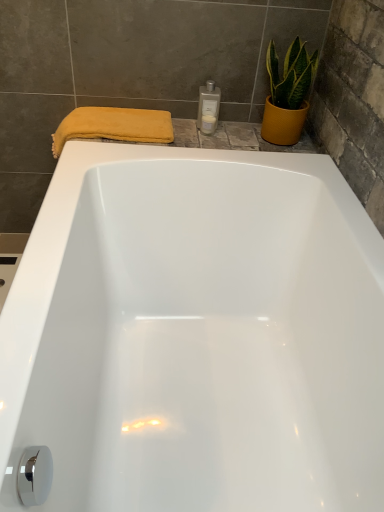
I want to click on yellow soft towel at upper left, so click(114, 126).

Does white glossy bottle at upper center, which is the first toiletry from bottom to top, have a smaller size compared to yellow textured pot at upper right?

Yes.

Is white glossy bottle at upper center, which is the first toiletry from bottom to top, shorter than yellow textured pot at upper right?

Correct, white glossy bottle at upper center, which is the first toiletry from bottom to top, is not as tall as yellow textured pot at upper right.

Do you think white glossy bottle at upper center, which is the first toiletry from bottom to top, is within yellow textured pot at upper right, or outside of it?

white glossy bottle at upper center, which is the first toiletry from bottom to top, is not inside yellow textured pot at upper right, it's outside.

Which point is more distant from viewer, (202, 126) or (281, 116)?

The point (202, 126) is more distant.

In order to click on houseplant above the white glossy bottle at upper center, the second toiletry positioned from the top (from the image's perspective) in this screenshot , I will do `click(288, 93)`.

Does yellow textured pot at upper right have a greater width compared to white glossy bottle at upper center, the second toiletry positioned from the top?

Yes.

How much distance is there between yellow textured pot at upper right and white glossy bottle at upper center, the second toiletry positioned from the top?

yellow textured pot at upper right is 9.64 inches away from white glossy bottle at upper center, the second toiletry positioned from the top.

Can you confirm if yellow textured pot at upper right is bigger than white glossy bottle at upper center, the second toiletry positioned from the top?

Yes.

Can you confirm if yellow soft towel at upper left is positioned to the right of white glossy bottle at upper right, which appears as the second toiletry when ordered from the bottom?

In fact, yellow soft towel at upper left is to the left of white glossy bottle at upper right, which appears as the second toiletry when ordered from the bottom.

From a real-world perspective, is yellow soft towel at upper left on top of white glossy bottle at upper right, which ranks as the 1th toiletry in top-to-bottom order?

No, from a real-world perspective, yellow soft towel at upper left is not on top of white glossy bottle at upper right, which ranks as the 1th toiletry in top-to-bottom order.

Is yellow soft towel at upper left next to white glossy bottle at upper right, which ranks as the 1th toiletry in top-to-bottom order?

No, yellow soft towel at upper left is not making contact with white glossy bottle at upper right, which ranks as the 1th toiletry in top-to-bottom order.

Who is taller, yellow soft towel at upper left or white glossy bottle at upper right, which appears as the second toiletry when ordered from the bottom?

yellow soft towel at upper left is taller.

Is there a large distance between yellow textured pot at upper right and yellow soft towel at upper left?

yellow textured pot at upper right is actually quite close to yellow soft towel at upper left.

Between yellow textured pot at upper right and yellow soft towel at upper left, which one has smaller width?

yellow textured pot at upper right is thinner.

In the image, is yellow textured pot at upper right positioned in front of or behind yellow soft towel at upper left?

Clearly, yellow textured pot at upper right is in front of yellow soft towel at upper left.

Which of these two, yellow textured pot at upper right or yellow soft towel at upper left, is smaller?

yellow textured pot at upper right is smaller.

Consider the image. From the image's perspective, which is below, yellow soft towel at upper left or white glossy bottle at upper center, the second toiletry positioned from the top?

yellow soft towel at upper left is shown below in the image.

Based on the photo, could you tell me if yellow soft towel at upper left is turned towards white glossy bottle at upper center, the second toiletry positioned from the top?

No, yellow soft towel at upper left does not turn towards white glossy bottle at upper center, the second toiletry positioned from the top.

Consider the image. Who is smaller, yellow soft towel at upper left or white glossy bottle at upper center, which is the first toiletry from bottom to top?

white glossy bottle at upper center, which is the first toiletry from bottom to top.

Are yellow soft towel at upper left and white glossy bottle at upper center, the second toiletry positioned from the top, located far from each other?

That's not correct — yellow soft towel at upper left is a little close to white glossy bottle at upper center, the second toiletry positioned from the top.

Is white glossy bottle at upper right, which appears as the second toiletry when ordered from the bottom, touching white glossy bottle at upper center, which is the first toiletry from bottom to top?

Yes, white glossy bottle at upper right, which appears as the second toiletry when ordered from the bottom, and white glossy bottle at upper center, which is the first toiletry from bottom to top, clearly make contact.

At what (x,y) coordinates should I click in order to perform the action: click on toiletry in front of the white glossy bottle at upper center, the second toiletry positioned from the top. Please return your answer as a coordinate pair (x, y). The width and height of the screenshot is (384, 512). Looking at the image, I should click on (208, 108).

Considering the relative positions of white glossy bottle at upper right, which appears as the second toiletry when ordered from the bottom, and white glossy bottle at upper center, which is the first toiletry from bottom to top, in the image provided, is white glossy bottle at upper right, which appears as the second toiletry when ordered from the bottom, to the right of white glossy bottle at upper center, which is the first toiletry from bottom to top, from the viewer's perspective?

Yes.

In terms of size, does white glossy bottle at upper right, which ranks as the 1th toiletry in top-to-bottom order, appear bigger or smaller than white glossy bottle at upper center, which is the first toiletry from bottom to top?

Considering their sizes, white glossy bottle at upper right, which ranks as the 1th toiletry in top-to-bottom order, takes up more space than white glossy bottle at upper center, which is the first toiletry from bottom to top.

Locate an element on the screen. The image size is (384, 512). bath towel in front of the white glossy bottle at upper right, which appears as the second toiletry when ordered from the bottom is located at coordinates (114, 126).

Is white glossy bottle at upper right, which appears as the second toiletry when ordered from the bottom, aimed at yellow soft towel at upper left?

No.

Can you confirm if white glossy bottle at upper right, which appears as the second toiletry when ordered from the bottom, is positioned to the right of yellow soft towel at upper left?

Yes, white glossy bottle at upper right, which appears as the second toiletry when ordered from the bottom, is to the right of yellow soft towel at upper left.

Considering the relative sizes of white glossy bottle at upper right, which ranks as the 1th toiletry in top-to-bottom order, and yellow soft towel at upper left in the image provided, is white glossy bottle at upper right, which ranks as the 1th toiletry in top-to-bottom order, smaller than yellow soft towel at upper left?

Yes.

Identify the location of toiletry that is the 2nd one when counting backward from the yellow textured pot at upper right. This screenshot has height=512, width=384. (208, 117).

Identify the location of houseplant that is above the white glossy bottle at upper center, the second toiletry positioned from the top (from the image's perspective). This screenshot has height=512, width=384. (288, 93).

Looking at this image, when comparing their distances from yellow textured pot at upper right, does white glossy bottle at upper right, which ranks as the 1th toiletry in top-to-bottom order, or yellow soft towel at upper left seem closer?

Among the two, white glossy bottle at upper right, which ranks as the 1th toiletry in top-to-bottom order, is located nearer to yellow textured pot at upper right.

Consider the image. Which object lies further to the anchor point yellow textured pot at upper right, white glossy bottle at upper right, which ranks as the 1th toiletry in top-to-bottom order, or white glossy bottle at upper center, which is the first toiletry from bottom to top?

Based on the image, white glossy bottle at upper center, which is the first toiletry from bottom to top, appears to be further to yellow textured pot at upper right.

Based on their spatial positions, is white glossy bottle at upper right, which ranks as the 1th toiletry in top-to-bottom order, or white glossy bottle at upper center, which is the first toiletry from bottom to top, further from yellow soft towel at upper left?

Based on the image, white glossy bottle at upper center, which is the first toiletry from bottom to top, appears to be further to yellow soft towel at upper left.

Estimate the real-world distances between objects in this image. Which object is closer to white glossy bottle at upper right, which ranks as the 1th toiletry in top-to-bottom order, yellow textured pot at upper right or white glossy bottle at upper center, which is the first toiletry from bottom to top?

white glossy bottle at upper center, which is the first toiletry from bottom to top.

Based on their spatial positions, is white glossy bottle at upper center, which is the first toiletry from bottom to top, or white glossy bottle at upper right, which appears as the second toiletry when ordered from the bottom, closer to yellow soft towel at upper left?

The object closer to yellow soft towel at upper left is white glossy bottle at upper right, which appears as the second toiletry when ordered from the bottom.

From the image, which object appears to be nearer to white glossy bottle at upper right, which appears as the second toiletry when ordered from the bottom, yellow soft towel at upper left or yellow textured pot at upper right?

yellow textured pot at upper right is positioned closer to the anchor white glossy bottle at upper right, which appears as the second toiletry when ordered from the bottom.

From the image, which object appears to be farther from white glossy bottle at upper center, which is the first toiletry from bottom to top, yellow textured pot at upper right or yellow soft towel at upper left?

yellow soft towel at upper left lies further to white glossy bottle at upper center, which is the first toiletry from bottom to top, than the other object.

Based on their spatial positions, is white glossy bottle at upper center, which is the first toiletry from bottom to top, or white glossy bottle at upper right, which ranks as the 1th toiletry in top-to-bottom order, further from yellow textured pot at upper right?

white glossy bottle at upper center, which is the first toiletry from bottom to top.

Locate an element on the screen. toiletry between yellow soft towel at upper left and white glossy bottle at upper right, which ranks as the 1th toiletry in top-to-bottom order is located at coordinates (208, 117).

Locate an element on the screen. toiletry between white glossy bottle at upper center, the second toiletry positioned from the top, and yellow textured pot at upper right is located at coordinates (208, 108).